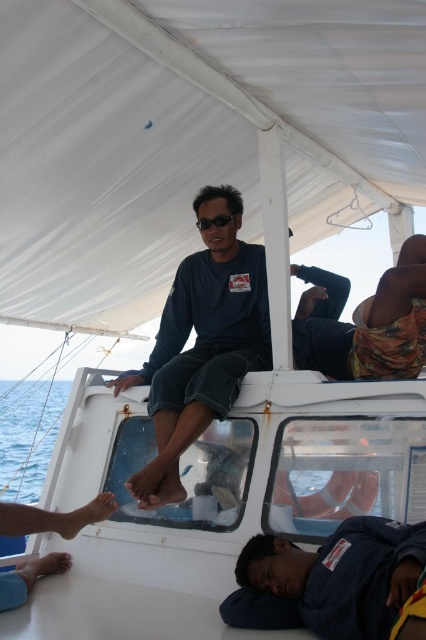
You are a passenger on the boat and want to put on your black plastic goggles at upper center. However, there is a dark blue fabric at lower right blocking your view. Can you reach the goggles without moving the fabric?

The dark blue fabric at lower right is in front of the black plastic goggles at upper center, so you would need to move the fabric to access the goggles.